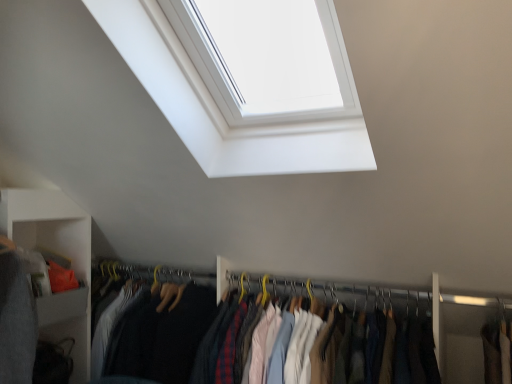
Question: Considering the positions of matte gray cabinet at lower left and white glossy window at upper center in the image, is matte gray cabinet at lower left taller or shorter than white glossy window at upper center?

Choices:
 (A) tall
 (B) short

Answer: (B)

Question: Is point (78, 269) positioned closer to the camera than point (135, 39)?

Choices:
 (A) closer
 (B) farther

Answer: (B)

Question: Estimate the real-world distances between objects in this image. Which object is closer to the matte fabric clothes at center?

Choices:
 (A) white glossy window at upper center
 (B) yellow metal hanger at center
 (C) white matte shelf at lower left
 (D) matte gray cabinet at lower left

Answer: (B)

Question: Estimate the real-world distances between objects in this image. Which object is farther from the white matte shelf at lower left?

Choices:
 (A) matte gray cabinet at lower left
 (B) yellow metal hanger at center
 (C) matte fabric clothes at center
 (D) white glossy window at upper center

Answer: (D)